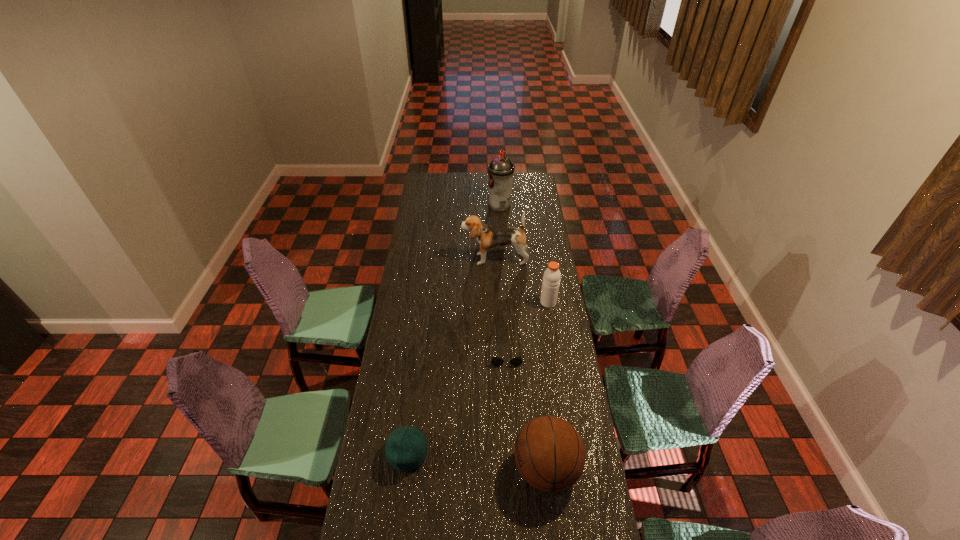
You are a GUI agent. You are given a task and a screenshot of the screen. Output one action in this format:
    pyautogui.click(x=<x>, y=<y>)
    Task: Click on the object that is at the left edge
    Image resolution: width=960 pixels, height=540 pixels.
    Given the screenshot: What is the action you would take?
    tap(406, 448)

Where is `puppy located in the right edge section of the desktop`? puppy located in the right edge section of the desktop is located at coordinates (488, 237).

You are a GUI agent. You are given a task and a screenshot of the screen. Output one action in this format:
    pyautogui.click(x=<x>, y=<y>)
    Task: Click on the shaker at the right edge
    This screenshot has height=540, width=960.
    Given the screenshot: What is the action you would take?
    pyautogui.click(x=551, y=279)

Locate an element on the screen. basketball that is at the right edge is located at coordinates 550,455.

At what (x,y) coordinates should I click in order to perform the action: click on vacant region at the far edge of the desktop. Please return your answer as a coordinate pair (x, y). Looking at the image, I should click on (464, 176).

Identify the location of vacant space at the left edge of the desktop. This screenshot has width=960, height=540. (429, 335).

Find the location of `vacant space at the right edge`. vacant space at the right edge is located at coordinates (542, 399).

Image resolution: width=960 pixels, height=540 pixels. Identify the location of vacant area that lies between the basketball and the leftmost object. (477, 461).

Locate an element on the screen. vacant space in between the fourth nearest object and the second farthest object is located at coordinates (521, 281).

What are the coordinates of `vacant area between the fifth shortest object and the leftmost object` in the screenshot? It's located at (451, 356).